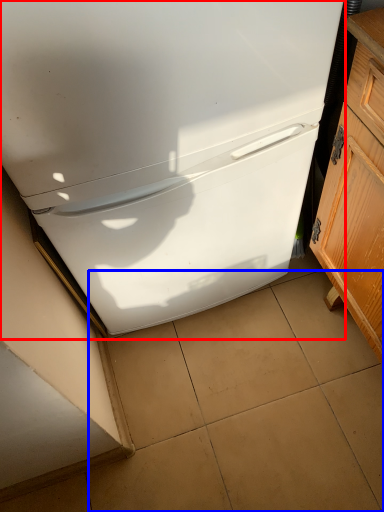
Question: Which object appears closest to the camera in this image, refrigerator (highlighted by a red box) or tile (highlighted by a blue box)?

Choices:
 (A) refrigerator
 (B) tile

Answer: (A)